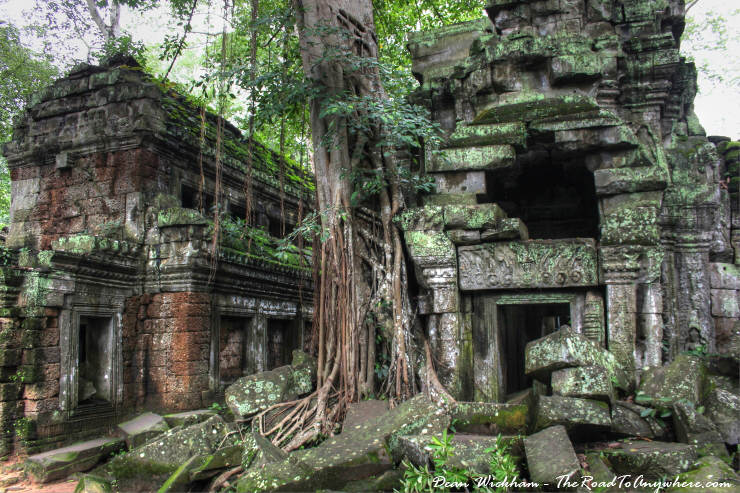
Identify the location of doorways. (97, 347), (511, 329), (531, 187).